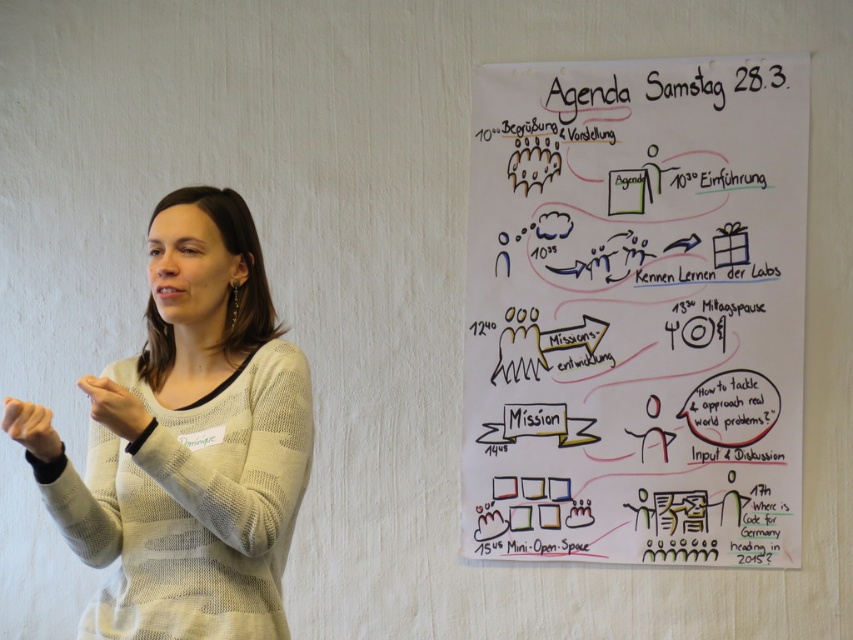
Question: Which point is closer to the camera?

Choices:
 (A) (769, 276)
 (B) (138, 412)

Answer: (B)

Question: Does white knitted sweater at center have a smaller size compared to matte white hand at lower left?

Choices:
 (A) yes
 (B) no

Answer: (B)

Question: Can you confirm if white knitted sweater at center is positioned below matte white hand at center?

Choices:
 (A) yes
 (B) no

Answer: (B)

Question: Which point is closer to the camera?

Choices:
 (A) [x=35, y=444]
 (B) [x=248, y=275]

Answer: (A)

Question: Estimate the real-world distances between objects in this image. Which object is closer to the matte white hand at lower left?

Choices:
 (A) white knitted sweater at center
 (B) white paper at upper right

Answer: (A)

Question: Is white knitted sweater at center wider than matte white hand at center?

Choices:
 (A) no
 (B) yes

Answer: (B)